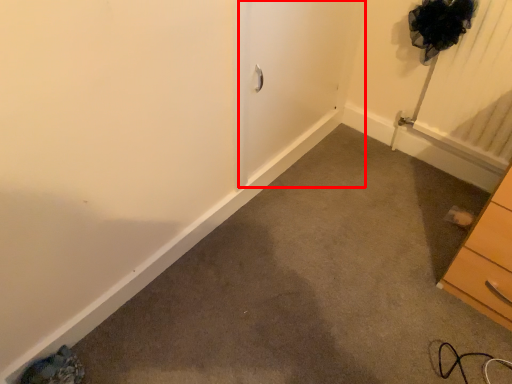
Question: From the image's perspective, what is the correct spatial positioning of screen door (annotated by the red box) in reference to chest of drawers?

Choices:
 (A) above
 (B) below

Answer: (A)